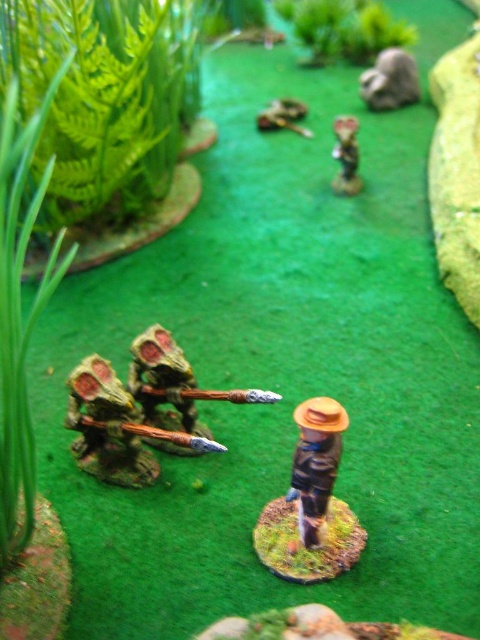
Question: Is green mossy spear at lower left thinner than wooden figure at upper center?

Choices:
 (A) no
 (B) yes

Answer: (A)

Question: Observing the image, what is the correct spatial positioning of wooden figure at upper center in reference to green matte snake at upper center?

Choices:
 (A) right
 (B) left

Answer: (A)

Question: Which is farther from the wooden figure at center?

Choices:
 (A) green mossy spear at lower left
 (B) green matte snake at upper center

Answer: (B)

Question: Which object appears farthest from the camera in this image?

Choices:
 (A) green matte snake at upper center
 (B) matte gray rock at upper center

Answer: (B)

Question: Which object is farther from the camera taking this photo?

Choices:
 (A) matte gray rock at upper center
 (B) brown matte figure at center
 (C) green matte snake at upper center
 (D) wooden figure at center

Answer: (A)

Question: Is green mossy spear at lower left to the right of wooden figure at center from the viewer's perspective?

Choices:
 (A) no
 (B) yes

Answer: (A)